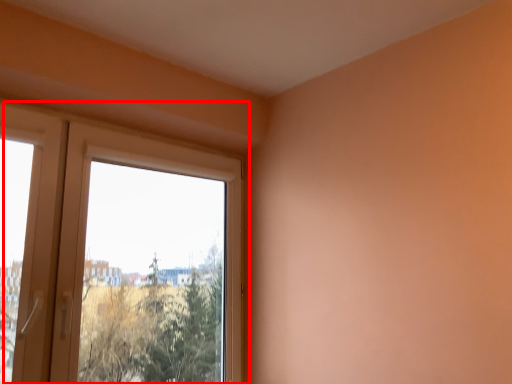
Question: From the image's perspective, where is window (annotated by the red box) located in relation to screen door in the image?

Choices:
 (A) below
 (B) above

Answer: (A)